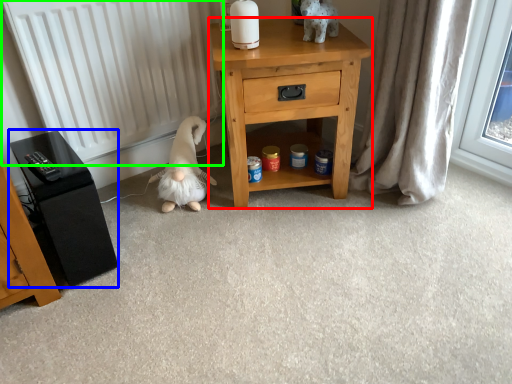
Question: Estimate the real-world distances between objects in this image. Which object is closer to nightstand (highlighted by a red box), vanity (highlighted by a blue box) or radiator (highlighted by a green box)?

Choices:
 (A) vanity
 (B) radiator

Answer: (B)